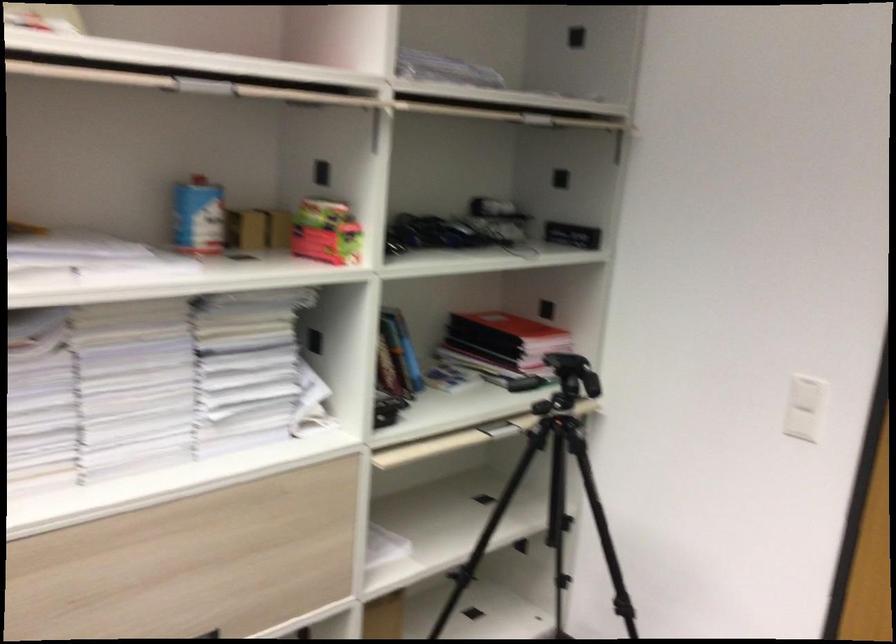
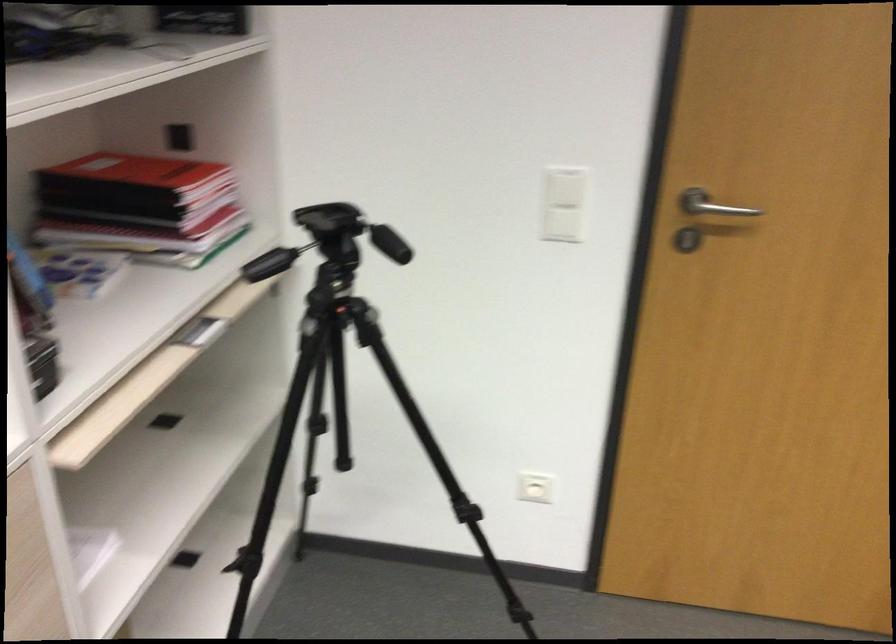
First-person continuous shooting, in which direction is the camera rotating?

The camera's rotation is toward right-down.